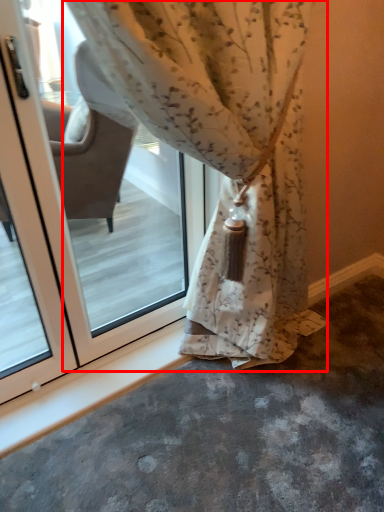
Question: From the image's perspective, what is the correct spatial relationship of curtain (annotated by the red box) in relation to screen door?

Choices:
 (A) above
 (B) below

Answer: (A)